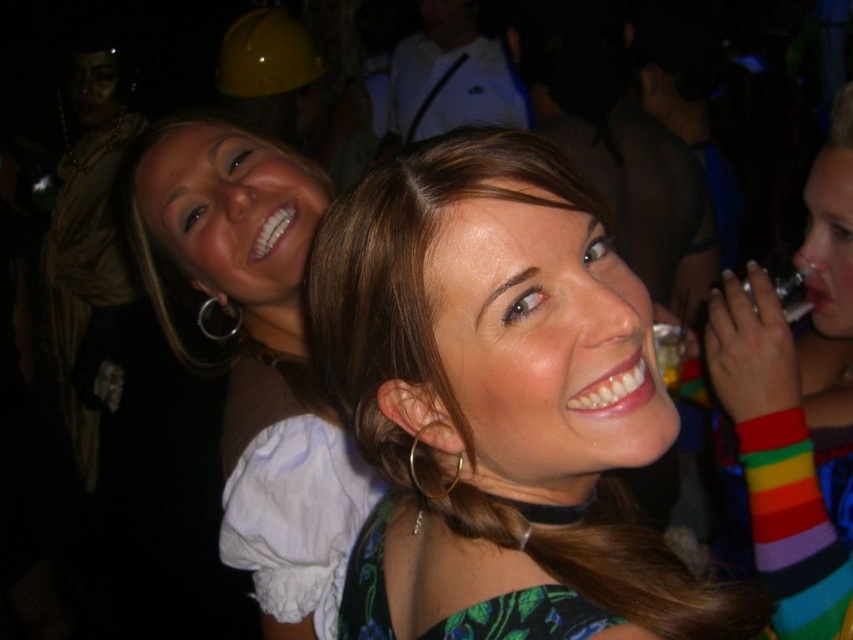
Who is lower down, matte green dress at center or rainbow striped wristband at right?

matte green dress at center

Which is behind, point (625, 424) or point (837, 326)?

The point (837, 326) is more distant.

Who is more distant from viewer, (363, 218) or (845, 365)?

The point (845, 365) is more distant.

At what (x,y) coordinates should I click in order to perform the action: click on matte green dress at center. Please return your answer as a coordinate pair (x, y). Looking at the image, I should click on (494, 394).

Based on the photo, which of these two, matte green dress at center or matte brown hair at center, stands shorter?

matte green dress at center is shorter.

Does point (587, 196) come closer to viewer compared to point (196, 289)?

Yes, point (587, 196) is closer to viewer.

Locate an element on the screen. Image resolution: width=853 pixels, height=640 pixels. matte green dress at center is located at coordinates (494, 394).

Locate an element on the screen. This screenshot has width=853, height=640. matte brown hair at center is located at coordinates (254, 355).

Does point (178, 256) lie behind point (747, 272)?

Yes.

Which is in front, point (219, 141) or point (834, 288)?

Point (834, 288)

Where is `matte brown hair at center`? The width and height of the screenshot is (853, 640). matte brown hair at center is located at coordinates (254, 355).